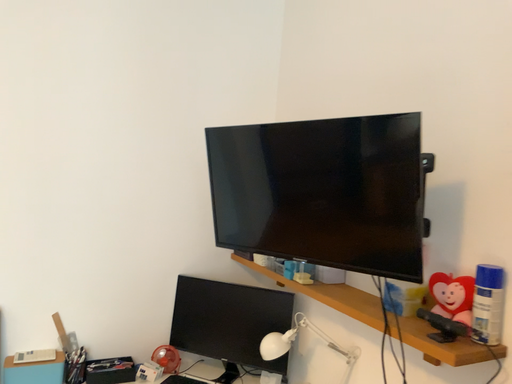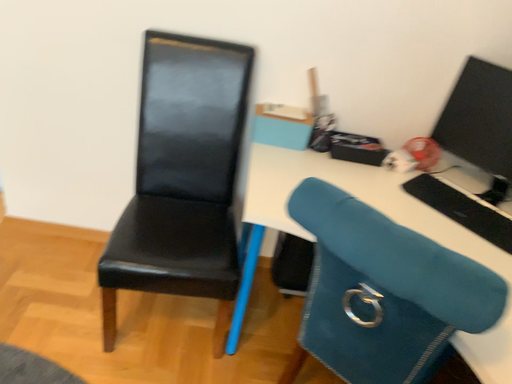
Question: How did the camera likely rotate when shooting the video?

Choices:
 (A) rotated left
 (B) rotated right

Answer: (A)